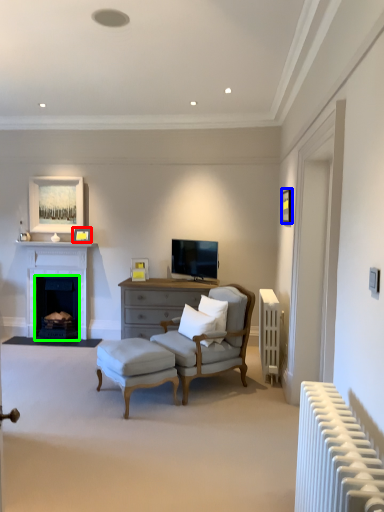
Question: Which object is the farthest from picture frame (highlighted by a red box)? Choose among these: picture frame (highlighted by a blue box) or fireplace (highlighted by a green box).

Choices:
 (A) picture frame
 (B) fireplace

Answer: (A)